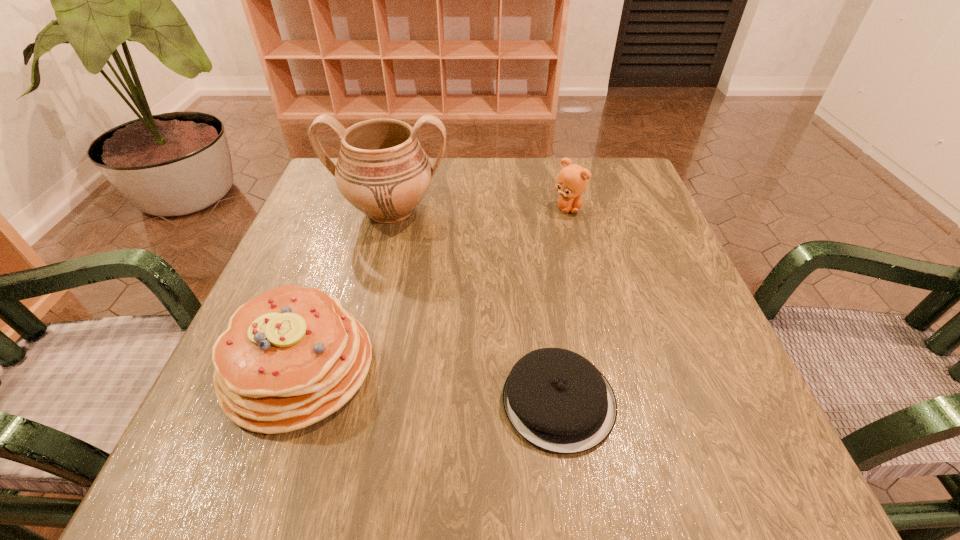
You are a GUI agent. You are given a task and a screenshot of the screen. Output one action in this format:
    pyautogui.click(x=<x>, y=<y>)
    Task: Click on the tallest object
    The image size is (960, 540).
    Given the screenshot: What is the action you would take?
    pyautogui.click(x=382, y=170)

Find the location of `teddy bear`. teddy bear is located at coordinates (x=572, y=180).

Find the location of a particular element. The image size is (960, 540). the taller pancake is located at coordinates (290, 357).

Where is `the right pancake`? The image size is (960, 540). the right pancake is located at coordinates (557, 400).

The image size is (960, 540). I want to click on the shorter pancake, so click(x=557, y=400).

Image resolution: width=960 pixels, height=540 pixels. In order to click on vacant space located on the front-facing side of the tallest object in this screenshot , I will do `click(351, 369)`.

In order to click on vacant space located 0.130m on the face of the teddy bear in this screenshot , I will do `click(579, 254)`.

You are a GUI agent. You are given a task and a screenshot of the screen. Output one action in this format:
    pyautogui.click(x=<x>, y=<y>)
    Task: Click on the vacant space located on the back of the left pancake
    
    Given the screenshot: What is the action you would take?
    pyautogui.click(x=355, y=208)

Find the location of a particular element. This screenshot has width=960, height=540. free space located on the left of the right pancake is located at coordinates (390, 401).

Where is `urn that is at the far edge`? This screenshot has width=960, height=540. urn that is at the far edge is located at coordinates (382, 170).